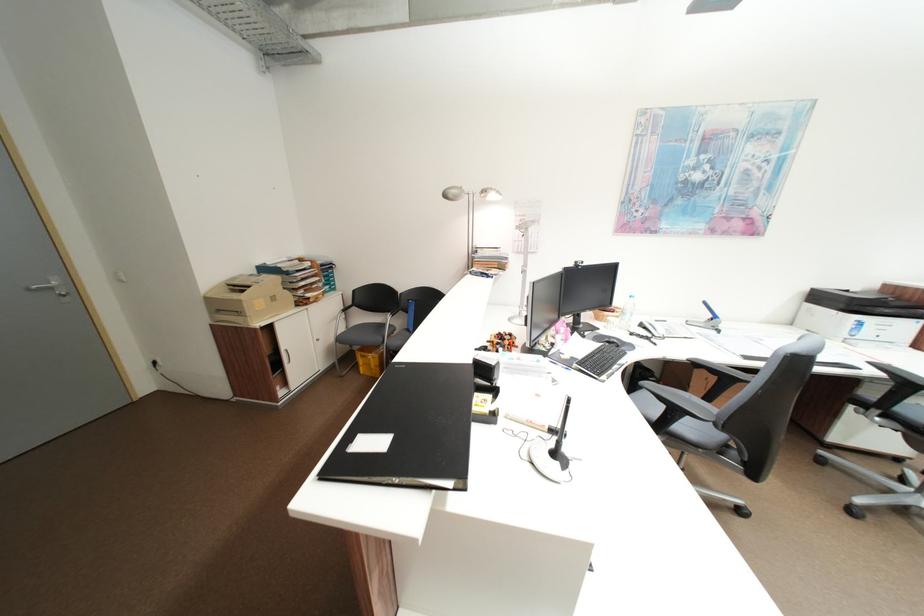
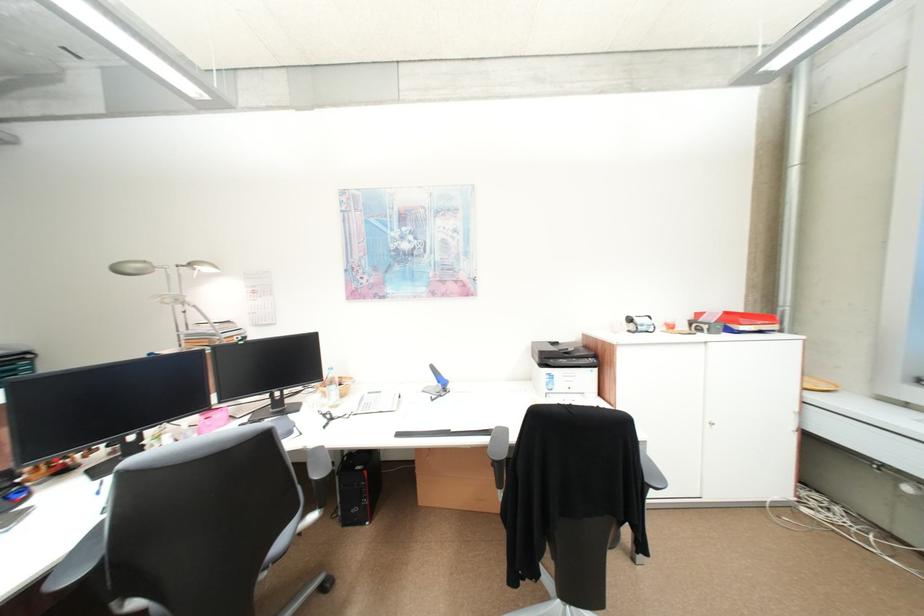
Find the pixel in the second image that matches [455,197] in the first image.

(127, 272)